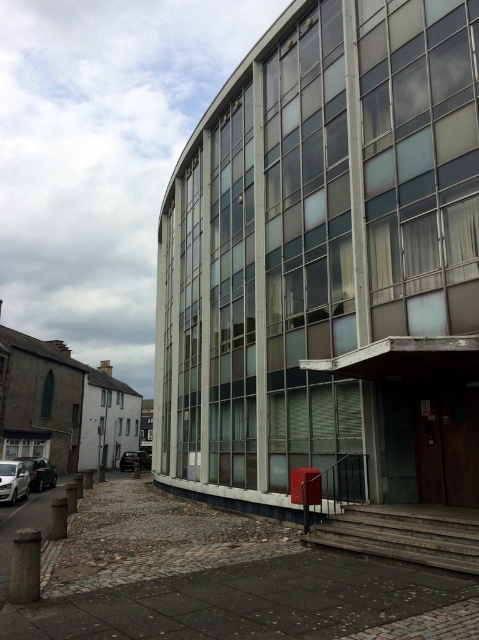
Question: Can you confirm if white glossy car at lower left is positioned to the right of shiny black car at lower left?

Choices:
 (A) no
 (B) yes

Answer: (B)

Question: Which of the following is the closest to the observer?

Choices:
 (A) black matte car at lower left
 (B) white glossy car at lower left
 (C) shiny black car at lower left

Answer: (B)

Question: Can you confirm if white glossy car at lower left is smaller than black matte car at lower left?

Choices:
 (A) yes
 (B) no

Answer: (A)

Question: Which point is farther to the camera?

Choices:
 (A) (141, 451)
 (B) (44, 458)
 (C) (8, 493)

Answer: (A)

Question: Is the position of shiny black car at lower left less distant than that of black matte car at lower left?

Choices:
 (A) yes
 (B) no

Answer: (A)

Question: Which object appears closest to the camera in this image?

Choices:
 (A) shiny black car at lower left
 (B) black matte car at lower left
 (C) white glossy car at lower left

Answer: (C)